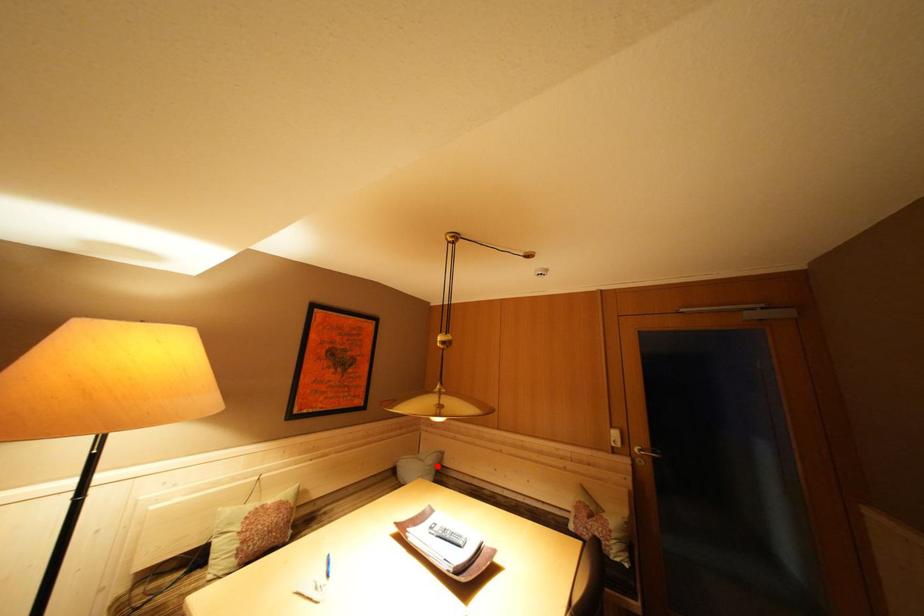
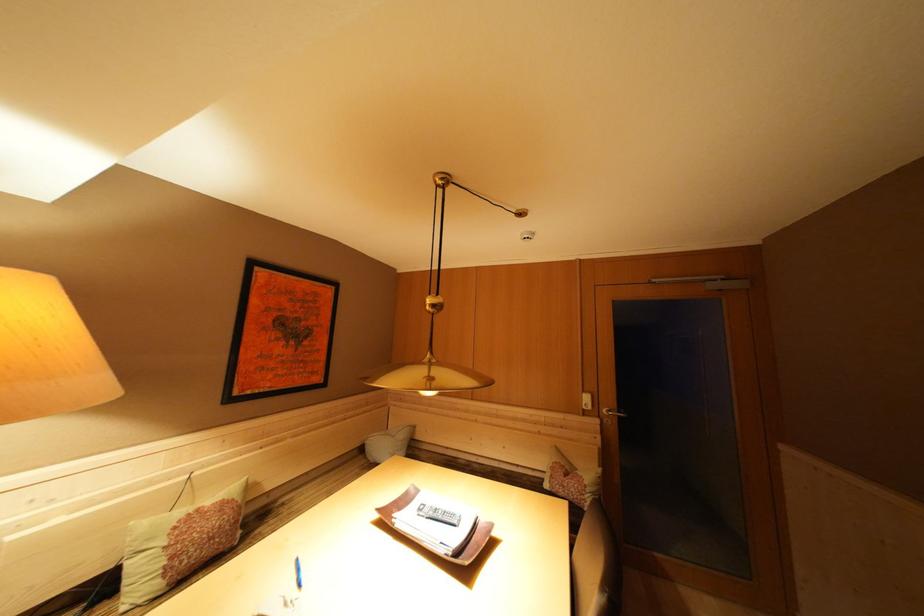
Where in the second image is the point corresponding to the highlighted location from the first image?

(408, 440)